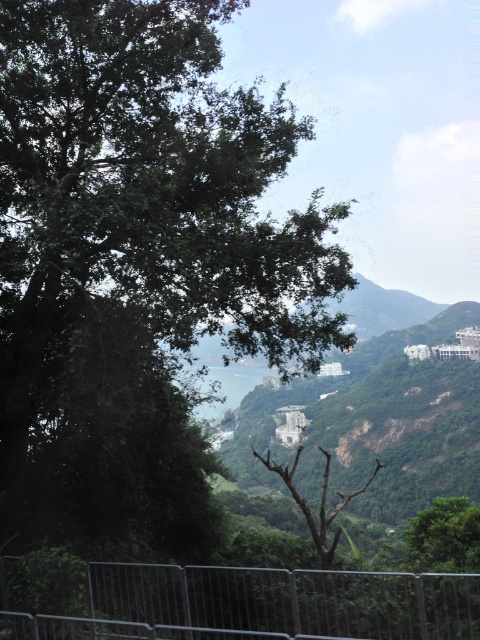
Does green leafy tree at upper left appear over brown dry wood at center?

Yes, green leafy tree at upper left is above brown dry wood at center.

Which is in front, point (4, 262) or point (323, 561)?

Point (323, 561) is more forward.

The image size is (480, 640). Identify the location of green leafy tree at upper left. 136,260.

Between metallic silver fence at lower center and brown dry wood at center, which one has more height?

brown dry wood at center is taller.

Which is above, metallic silver fence at lower center or brown dry wood at center?

metallic silver fence at lower center is higher up.

Is point (249, 625) farther from viewer compared to point (290, 484)?

No.

Find the location of a particular element. This screenshot has height=640, width=480. metallic silver fence at lower center is located at coordinates (253, 598).

Is green leafy tree at upper left behind metallic silver fence at lower center?

That is True.

Who is more forward, (214, 67) or (372, 636)?

Point (372, 636) is more forward.

This screenshot has height=640, width=480. Find the location of `green leafy tree at upper left`. green leafy tree at upper left is located at coordinates (136, 260).